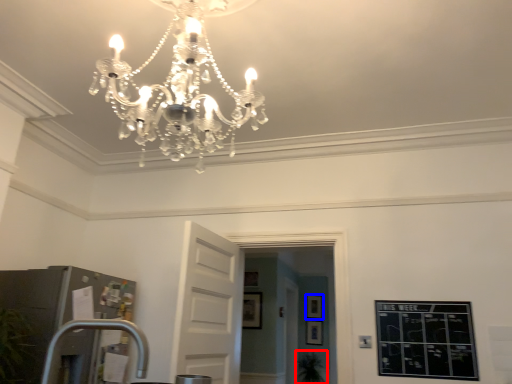
Question: Which object is closer to the camera taking this photo, plant (highlighted by a red box) or picture frame (highlighted by a blue box)?

Choices:
 (A) plant
 (B) picture frame

Answer: (A)